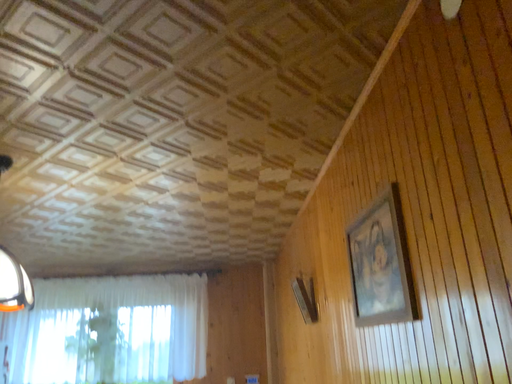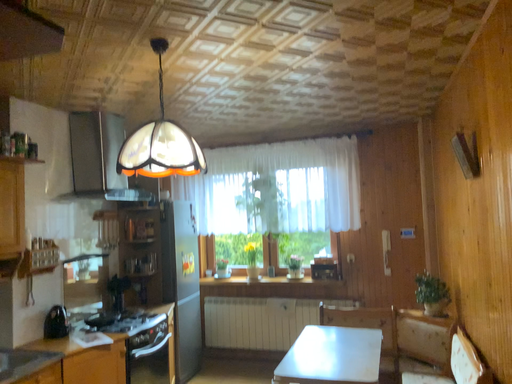
Question: How did the camera likely rotate when shooting the video?

Choices:
 (A) rotated upward
 (B) rotated downward

Answer: (B)